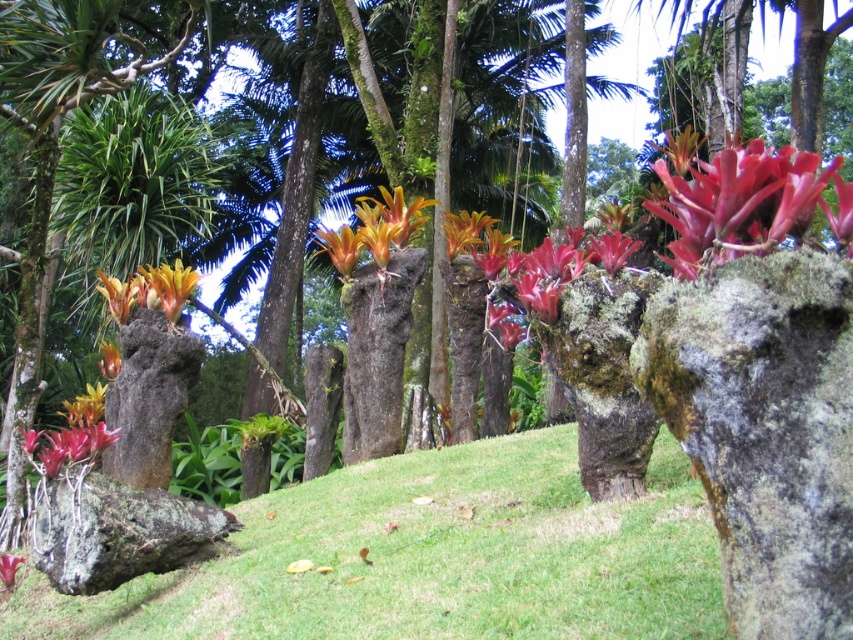
Does vibrant orange and yellow flower at center have a lesser width compared to orange matte flower at center?

Yes, vibrant orange and yellow flower at center is thinner than orange matte flower at center.

Can you confirm if vibrant orange and yellow flower at center is wider than orange matte flower at center?

Incorrect, vibrant orange and yellow flower at center's width does not surpass orange matte flower at center's.

I want to click on vibrant orange and yellow flower at center, so click(463, 230).

In order to click on vibrant orange and yellow flower at center in this screenshot , I will do `click(463, 230)`.

Which is more to the left, mossy rock at center-right or orange glossy flower at center?

From the viewer's perspective, orange glossy flower at center appears more on the left side.

Can you confirm if mossy rock at center-right is thinner than orange glossy flower at center?

Indeed, mossy rock at center-right has a lesser width compared to orange glossy flower at center.

You are a GUI agent. You are given a task and a screenshot of the screen. Output one action in this format:
    pyautogui.click(x=<x>, y=<y>)
    Task: Click on the mossy rock at center-right
    
    Given the screenshot: What is the action you would take?
    pyautogui.click(x=764, y=428)

Where is `mossy rock at center-right`? This screenshot has width=853, height=640. mossy rock at center-right is located at coordinates (764, 428).

Between orange glossy flower at center and orange matte flower at center, which one has more height?

orange glossy flower at center is taller.

Is point (321, 241) more distant than point (113, 362)?

Yes.

At what (x,y) coordinates should I click in order to perform the action: click on orange glossy flower at center. Please return your answer as a coordinate pair (x, y). Looking at the image, I should click on (341, 248).